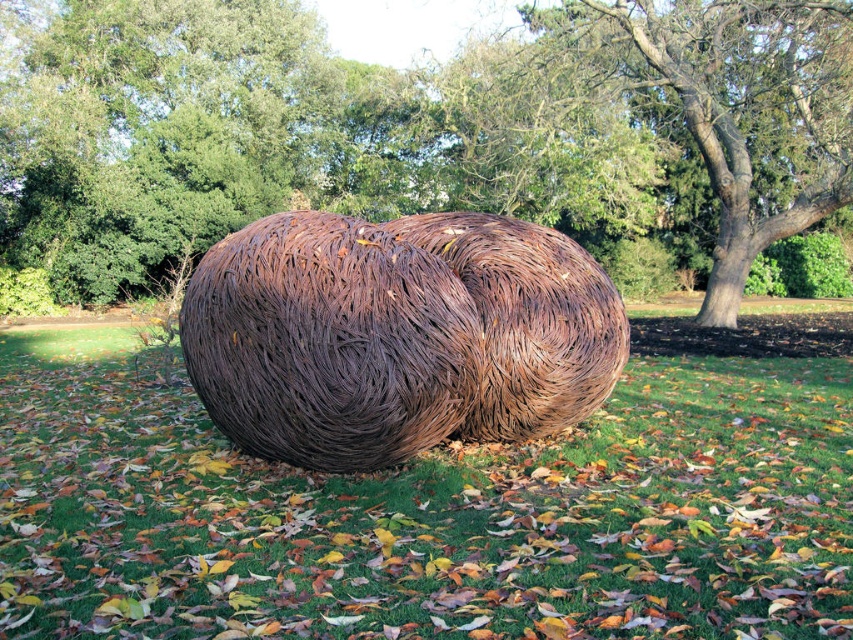
You are standing in a park and see the rusty wire sculpture at center and the brown textured tree at center. Which object is closer to you?

The rusty wire sculpture at center is closer to you because it is in front of the brown textured tree at center.